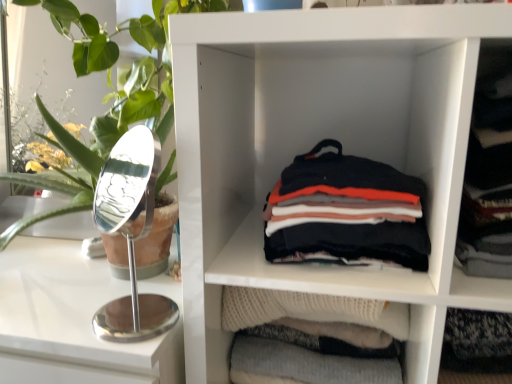
You are a GUI agent. You are given a task and a screenshot of the screen. Output one action in this format:
    pyautogui.click(x=<x>, y=<y>)
    Task: Click on the blank space situated above white glossy counter at left (from a real-world perspective)
    Image resolution: width=512 pixels, height=384 pixels.
    Given the screenshot: What is the action you would take?
    pyautogui.click(x=57, y=267)